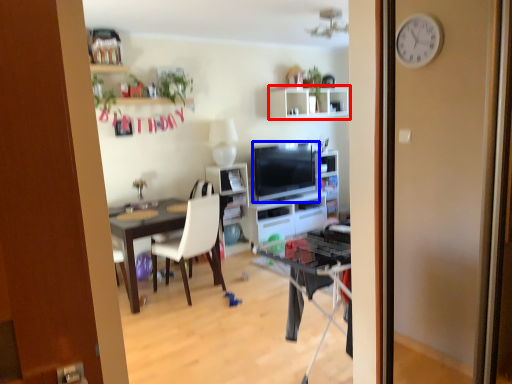
Question: Among these objects, which one is farthest to the camera, shelf (highlighted by a red box) or television (highlighted by a blue box)?

Choices:
 (A) shelf
 (B) television

Answer: (A)